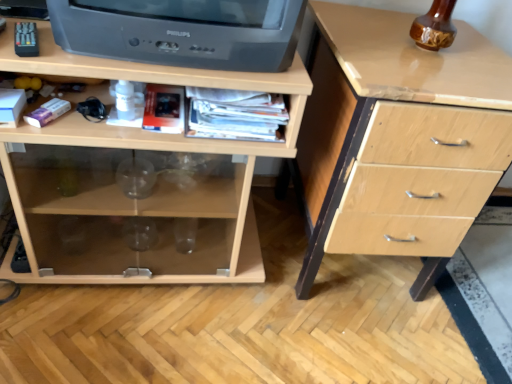
The width and height of the screenshot is (512, 384). What are the coordinates of `free space that is in between light wood chest of drawers at center, arranged as the first chest of drawers when viewed from the left, and light wood chest of drawers at right, the 2th chest of drawers viewed from the left` in the screenshot? It's located at (264, 253).